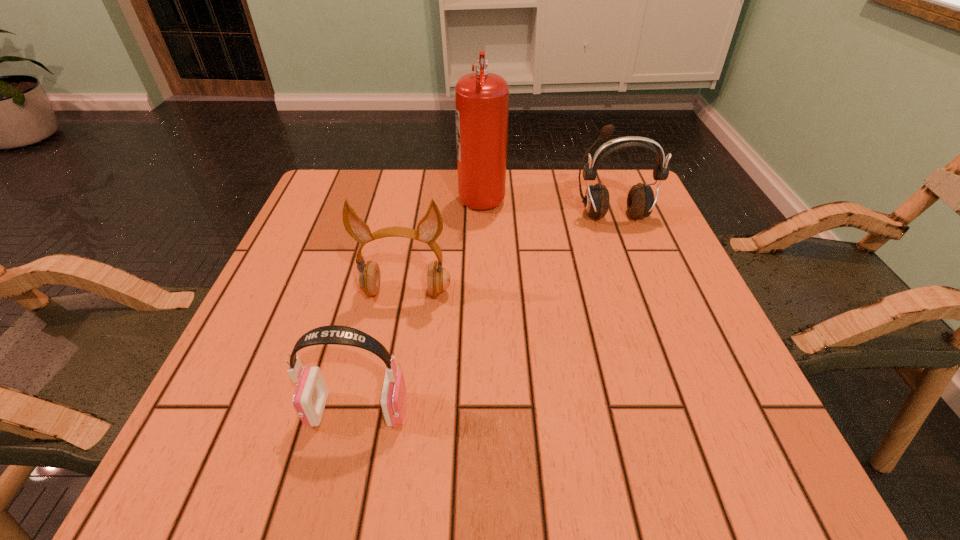
Locate an element on the screen. The image size is (960, 540). free space between the tallest object and the farthest earphone is located at coordinates (547, 205).

At what (x,y) coordinates should I click in order to perform the action: click on free space between the nearest object and the farthest earphone. Please return your answer as a coordinate pair (x, y). Looking at the image, I should click on (485, 313).

You are a GUI agent. You are given a task and a screenshot of the screen. Output one action in this format:
    pyautogui.click(x=<x>, y=<y>)
    Task: Click on the free spot between the second nearest object and the second object from right to left
    
    Given the screenshot: What is the action you would take?
    pyautogui.click(x=444, y=244)

Find the location of `free space between the farthest earphone and the shortest earphone`. free space between the farthest earphone and the shortest earphone is located at coordinates (485, 313).

The height and width of the screenshot is (540, 960). Identify the location of object that can be found as the second closest to the rightmost earphone. (367, 279).

Identify which object is located as the nearest to the fire extinguisher. Please provide its 2D coordinates. Your answer should be formatted as a tuple, i.e. [(x, y)], where the tuple contains the x and y coordinates of a point satisfying the conditions above.

[(640, 201)]

Locate which earphone is the second closest to the shortest object. Please provide its 2D coordinates. Your answer should be formatted as a tuple, i.e. [(x, y)], where the tuple contains the x and y coordinates of a point satisfying the conditions above.

[(640, 201)]

Select which earphone is the closest to the second nearest object. Please provide its 2D coordinates. Your answer should be formatted as a tuple, i.e. [(x, y)], where the tuple contains the x and y coordinates of a point satisfying the conditions above.

[(311, 393)]

The width and height of the screenshot is (960, 540). I want to click on vacant space that satisfies the following two spatial constraints: 1. on the front-facing side of the second nearest earphone; 2. on the outer surface of the shortest object, so click(x=384, y=410).

At what (x,y) coordinates should I click in order to perform the action: click on free space that satisfies the following two spatial constraints: 1. on the ear pads of the rightmost earphone; 2. on the outer surface of the shortest earphone. Please return your answer as a coordinate pair (x, y). Image resolution: width=960 pixels, height=540 pixels. Looking at the image, I should click on (685, 410).